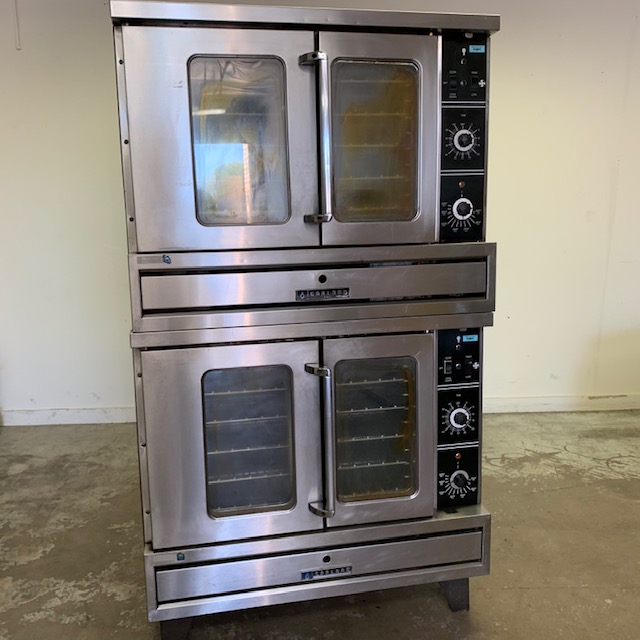
Locate an element on the screen. This screenshot has height=640, width=640. knobs is located at coordinates (461, 483), (458, 416), (463, 210), (466, 140).